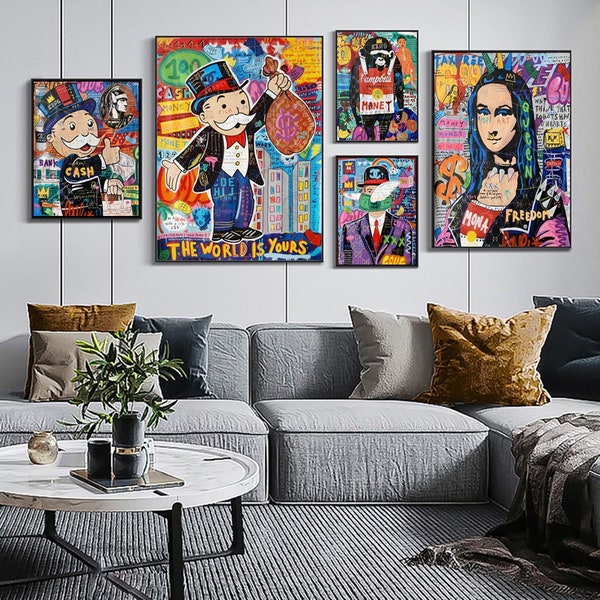
Find the location of a particular element. The width and height of the screenshot is (600, 600). frames art is located at coordinates 93,131, 243,123, 374,83, 378,194, 514,150.